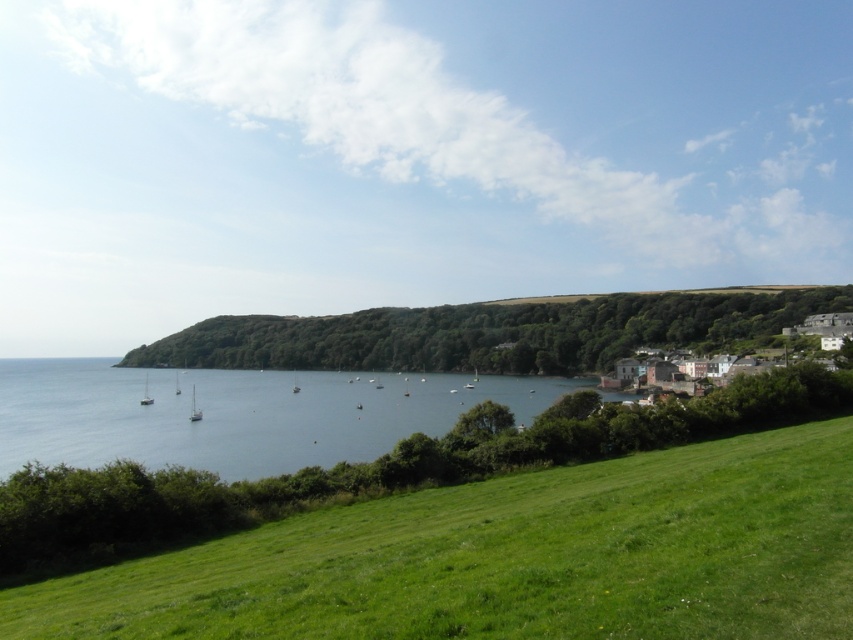
You are standing at a viewpoint overlooking the coastal landscape. You notice two points marked on the image. The first point is at coordinate point(735,464) and the second is at point(195,417). Which of these points is closer to you, the observer?

Point(735,464) is in front of point(195,417), so it is closer to you.

You are standing on the green grassy field at lower left and want to reach the white glossy sailboat at center. Which direction should you walk to get there?

You should walk towards the center of the image because the green grassy field at lower left is in front of the white glossy sailboat at center, meaning the sailboat is further away in the direction away from the field.